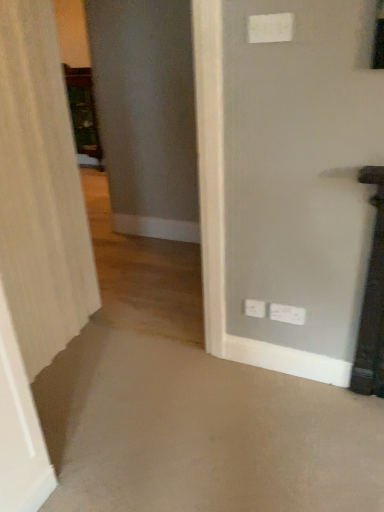
Question: Is wooden cabinet at left to the right of white textured curtain at left from the viewer's perspective?

Choices:
 (A) no
 (B) yes

Answer: (A)

Question: From a real-world perspective, is wooden cabinet at left on white textured curtain at left?

Choices:
 (A) no
 (B) yes

Answer: (A)

Question: From a real-world perspective, is wooden cabinet at left located beneath white textured curtain at left?

Choices:
 (A) yes
 (B) no

Answer: (A)

Question: Are wooden cabinet at left and white textured curtain at left located far from each other?

Choices:
 (A) no
 (B) yes

Answer: (B)

Question: Is wooden cabinet at left turned away from white textured curtain at left?

Choices:
 (A) no
 (B) yes

Answer: (A)

Question: From a real-world perspective, is white plastic electric outlet at upper center, the 3th electric outlet positioned from the bottom, above or below wooden cabinet at left?

Choices:
 (A) above
 (B) below

Answer: (A)

Question: In terms of height, does white plastic electric outlet at upper center, arranged as the third electric outlet when viewed from the back, look taller or shorter compared to wooden cabinet at left?

Choices:
 (A) tall
 (B) short

Answer: (B)

Question: In the image, is white plastic electric outlet at upper center, arranged as the first electric outlet when viewed from the top, positioned in front of or behind wooden cabinet at left?

Choices:
 (A) front
 (B) behind

Answer: (A)

Question: Choose the correct answer: Is white plastic electric outlet at upper center, arranged as the first electric outlet when viewed from the top, inside wooden cabinet at left or outside it?

Choices:
 (A) inside
 (B) outside

Answer: (B)

Question: Relative to white textured curtain at left, is white plastic electric outlet at upper center, arranged as the third electric outlet when viewed from the back, in front or behind?

Choices:
 (A) front
 (B) behind

Answer: (B)

Question: Considering the positions of white plastic electric outlet at upper center, the 3th electric outlet positioned from the bottom, and white textured curtain at left in the image, is white plastic electric outlet at upper center, the 3th electric outlet positioned from the bottom, bigger or smaller than white textured curtain at left?

Choices:
 (A) big
 (B) small

Answer: (B)

Question: Based on their positions, is white plastic electric outlet at upper center, arranged as the first electric outlet when viewed from the front, located to the left or right of white textured curtain at left?

Choices:
 (A) left
 (B) right

Answer: (B)

Question: From a real-world perspective, is white plastic electric outlet at upper center, the 3th electric outlet positioned from the bottom, physically located above or below white textured curtain at left?

Choices:
 (A) below
 (B) above

Answer: (B)

Question: From the image's perspective, is white plastic electric outlet at lower right, the first electric outlet from the back, positioned above or below white textured curtain at left?

Choices:
 (A) above
 (B) below

Answer: (B)

Question: In terms of height, does white plastic electric outlet at lower right, which is counted as the 3th electric outlet, starting from the front, look taller or shorter compared to white textured curtain at left?

Choices:
 (A) short
 (B) tall

Answer: (A)